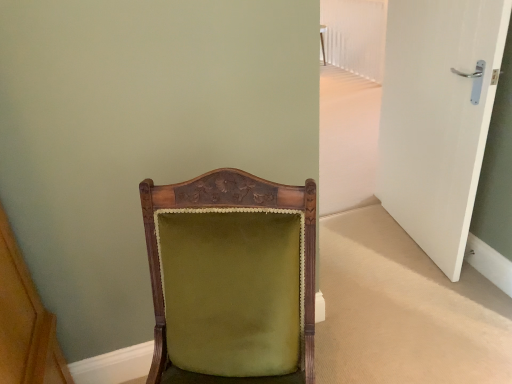
Question: From a real-world perspective, is white glossy door at right positioned above or below velvet green chair at center?

Choices:
 (A) above
 (B) below

Answer: (A)

Question: Is white glossy door at right in front of or behind velvet green chair at center in the image?

Choices:
 (A) behind
 (B) front

Answer: (A)

Question: Is point (390, 82) positioned closer to the camera than point (156, 264)?

Choices:
 (A) farther
 (B) closer

Answer: (A)

Question: Is point (180, 311) closer or farther from the camera than point (394, 192)?

Choices:
 (A) closer
 (B) farther

Answer: (A)

Question: Would you say velvet green chair at center is inside or outside white glossy door at right?

Choices:
 (A) outside
 (B) inside

Answer: (A)

Question: Considering the positions of velvet green chair at center and white glossy door at right in the image, is velvet green chair at center taller or shorter than white glossy door at right?

Choices:
 (A) tall
 (B) short

Answer: (B)

Question: Visually, is velvet green chair at center positioned to the left or to the right of white glossy door at right?

Choices:
 (A) left
 (B) right

Answer: (A)